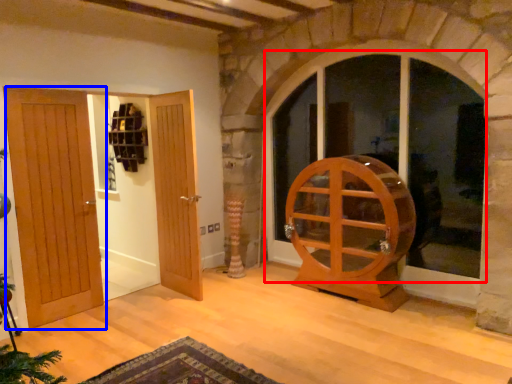
Question: Which object is closer to the camera taking this photo, window (highlighted by a red box) or door (highlighted by a blue box)?

Choices:
 (A) window
 (B) door

Answer: (B)